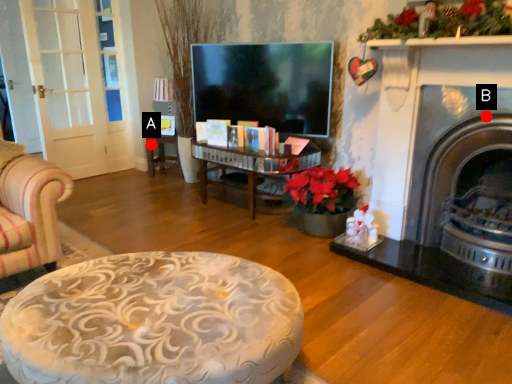
Question: Two points are circled on the image, labeled by A and B beside each circle. Which point is farther to the camera?

Choices:
 (A) A is further
 (B) B is further

Answer: (A)